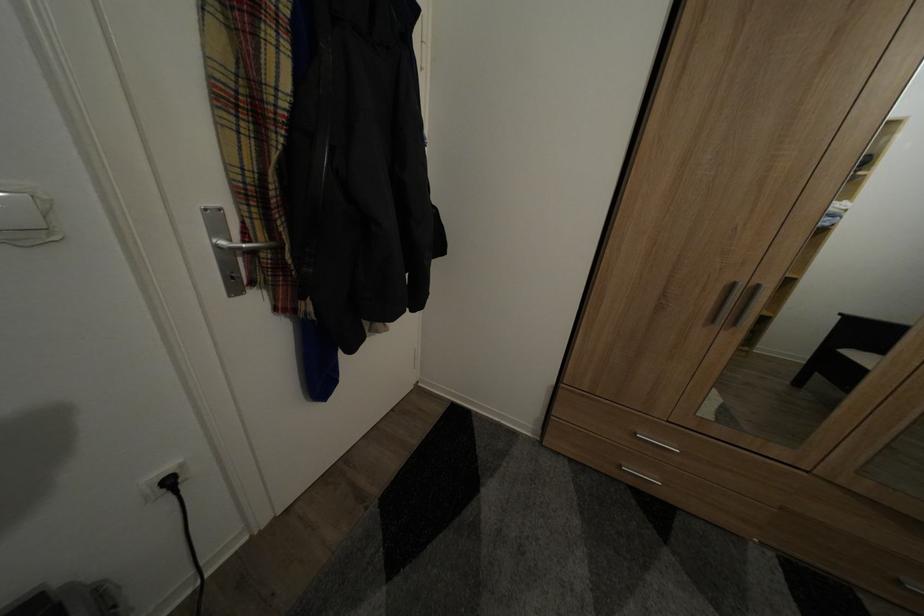
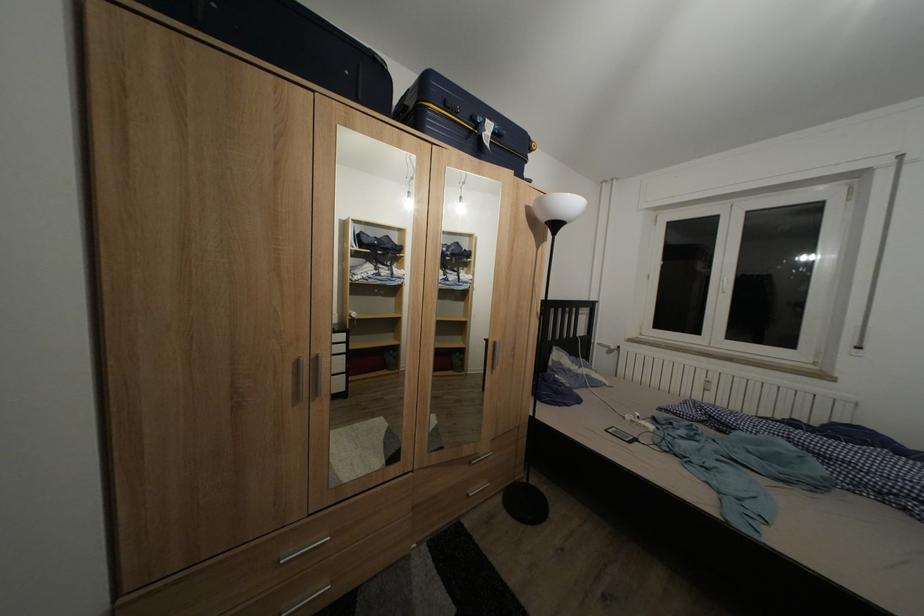
Question: The camera is either moving clockwise (left) or counter-clockwise (right) around the object. The first image is from the beginning of the video and the second image is from the end. Is the camera moving left or right when shooting the video?

Choices:
 (A) Left
 (B) Right

Answer: (A)